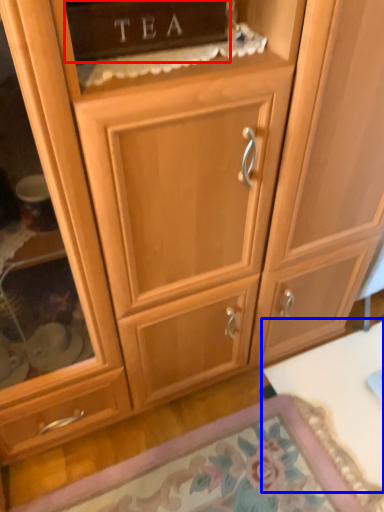
Question: Which object is closer to the camera taking this photo, cabinetry (highlighted by a red box) or table (highlighted by a blue box)?

Choices:
 (A) cabinetry
 (B) table

Answer: (A)